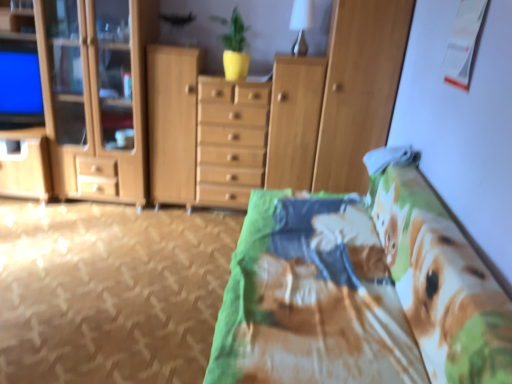
Question: Visually, is printed fabric bed at center positioned to the left or to the right of wooden cabinet at left, which ranks as the 1th cabinetry in left-to-right order?

Choices:
 (A) right
 (B) left

Answer: (A)

Question: Relative to wooden cabinet at left, which ranks as the second cabinetry in right-to-left order, is printed fabric bed at center in front or behind?

Choices:
 (A) behind
 (B) front

Answer: (B)

Question: Considering the real-world distances, which object is closest to the wooden cabinet at center?

Choices:
 (A) wooden cabinet at center, the second cabinetry positioned from the left
 (B) printed fabric bed at center
 (C) wooden cabinet at left, which ranks as the second cabinetry in right-to-left order

Answer: (A)

Question: Which is nearer to the wooden cabinet at center?

Choices:
 (A) wooden cabinet at center, the first cabinetry from the right
 (B) printed fabric bed at center
 (C) wooden cabinet at left, which ranks as the 1th cabinetry in left-to-right order

Answer: (A)